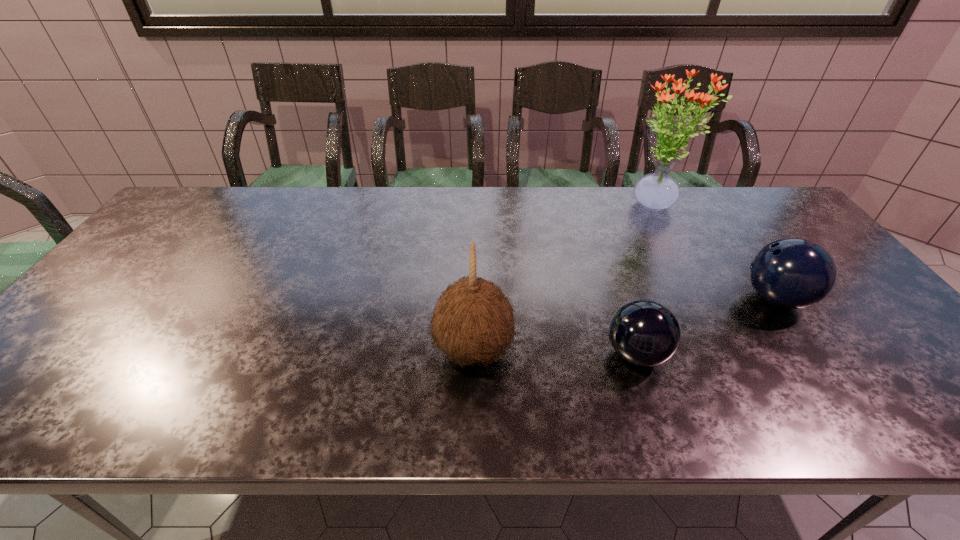
Choose which object is the nearest neighbor to the taller bowling ball. Please provide its 2D coordinates. Your answer should be formatted as a tuple, i.e. [(x, y)], where the tuple contains the x and y coordinates of a point satisfying the conditions above.

[(643, 332)]

Locate an element on the screen. The height and width of the screenshot is (540, 960). vacant space that satisfies the following two spatial constraints: 1. on the front side of the tallest object; 2. on the side of the second object from left to right with the finger holes is located at coordinates (736, 354).